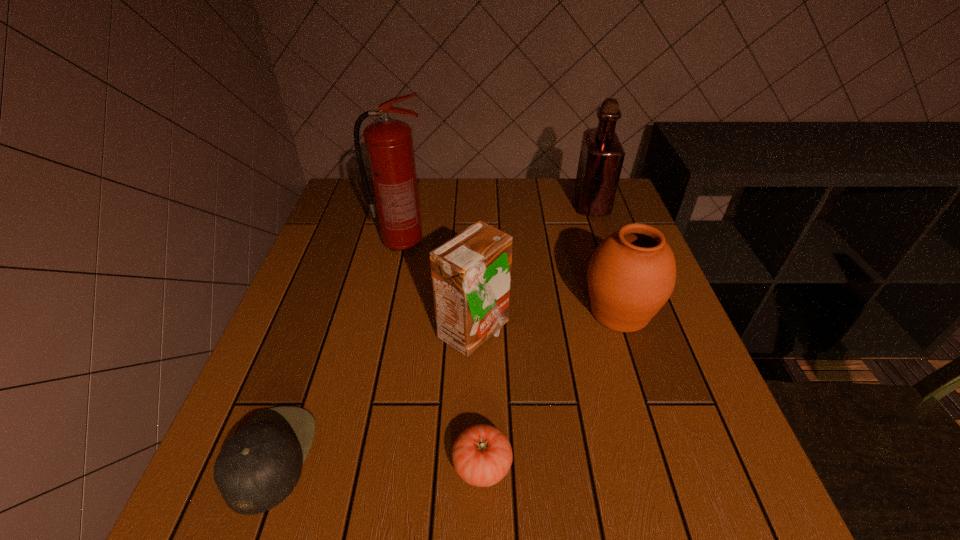
Locate an element on the screen. liquor located at the right edge is located at coordinates (601, 158).

Locate an element on the screen. The image size is (960, 540). urn that is positioned at the right edge is located at coordinates (x=631, y=275).

Find the location of a particular element. This screenshot has height=540, width=960. object that is positioned at the near left corner is located at coordinates (256, 469).

You are a GUI agent. You are given a task and a screenshot of the screen. Output one action in this format:
    pyautogui.click(x=<x>, y=<y>)
    Task: Click on the object present at the far right corner
    This screenshot has width=960, height=540.
    Given the screenshot: What is the action you would take?
    pyautogui.click(x=601, y=158)

Where is `vacant space at the far edge`? The height and width of the screenshot is (540, 960). vacant space at the far edge is located at coordinates (444, 202).

Locate an element on the screen. vacant space at the left edge of the desktop is located at coordinates (340, 286).

Where is `free space at the right edge of the desktop`? The height and width of the screenshot is (540, 960). free space at the right edge of the desktop is located at coordinates (618, 227).

This screenshot has height=540, width=960. I want to click on free space at the far left corner of the desktop, so click(337, 202).

Locate an element on the screen. The image size is (960, 540). vacant area at the near left corner of the desktop is located at coordinates (220, 498).

Find the location of a particular element. The height and width of the screenshot is (540, 960). vacant space at the far right corner of the desktop is located at coordinates (619, 198).